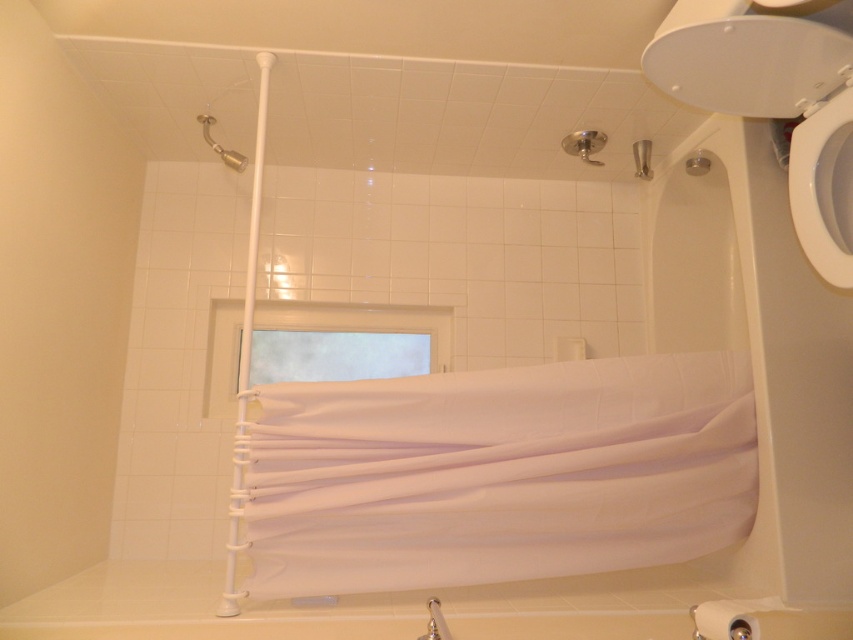
Question: Is white fabric curtain at center smaller than metallic silver showerhead at upper center?

Choices:
 (A) no
 (B) yes

Answer: (A)

Question: Which object is positioned closest to the white glossy toilet bowl at right?

Choices:
 (A) white fabric curtain at center
 (B) metallic showerhead at upper left

Answer: (A)

Question: From the image, what is the correct spatial relationship of white fabric curtain at center in relation to white glossy toilet bowl at right?

Choices:
 (A) above
 (B) below

Answer: (B)

Question: Is white glossy toilet bowl at right behind transparent glass window at upper center?

Choices:
 (A) yes
 (B) no

Answer: (B)

Question: Which is nearer to the metallic showerhead at upper left?

Choices:
 (A) clear glass window at upper center
 (B) metallic silver showerhead at upper center

Answer: (A)

Question: Which object appears closest to the camera in this image?

Choices:
 (A) metallic showerhead at upper left
 (B) white fabric curtain at center
 (C) white glossy toilet bowl at right

Answer: (C)